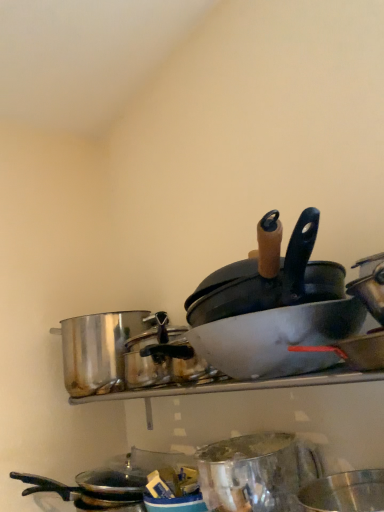
Question: Is metallic silver basin at center, arranged as the second basin when ordered from the bottom, taller than shiny metallic basin at lower right, which appears as the 1th basin when ordered from the bottom?

Choices:
 (A) yes
 (B) no

Answer: (B)

Question: Could you tell me if metallic silver basin at center, which ranks as the 1th basin in top-to-bottom order, is facing shiny metallic basin at lower right, the 2th basin when ordered from top to bottom?

Choices:
 (A) no
 (B) yes

Answer: (A)

Question: Is shiny metallic basin at lower right, which appears as the 1th basin when ordered from the bottom, located within metallic silver basin at center, arranged as the second basin when ordered from the bottom?

Choices:
 (A) yes
 (B) no

Answer: (B)

Question: Is metallic silver basin at center, which ranks as the 1th basin in top-to-bottom order, placed right next to shiny metallic basin at lower right, the 2th basin when ordered from top to bottom?

Choices:
 (A) yes
 (B) no

Answer: (B)

Question: Does metallic silver basin at center, which ranks as the 1th basin in top-to-bottom order, come behind shiny metallic basin at lower right, which appears as the 1th basin when ordered from the bottom?

Choices:
 (A) yes
 (B) no

Answer: (A)

Question: Is metallic silver basin at center, which ranks as the 1th basin in top-to-bottom order, facing away from shiny metallic basin at lower right, the 2th basin when ordered from top to bottom?

Choices:
 (A) yes
 (B) no

Answer: (B)

Question: Is shiny metallic pot at left behind matte white wok at center?

Choices:
 (A) yes
 (B) no

Answer: (A)

Question: From a real-world perspective, is shiny metallic pot at left physically below matte white wok at center?

Choices:
 (A) yes
 (B) no

Answer: (B)

Question: Does shiny metallic pot at left come in front of matte white wok at center?

Choices:
 (A) yes
 (B) no

Answer: (B)

Question: Is shiny metallic pot at left oriented towards matte white wok at center?

Choices:
 (A) no
 (B) yes

Answer: (A)

Question: From the image's perspective, is shiny metallic pot at left on matte white wok at center?

Choices:
 (A) yes
 (B) no

Answer: (B)

Question: Considering the relative sizes of shiny metallic pot at left and matte white wok at center in the image provided, is shiny metallic pot at left shorter than matte white wok at center?

Choices:
 (A) no
 (B) yes

Answer: (A)

Question: Does shiny metallic basin at lower right, the 2th basin when ordered from top to bottom, lie behind metallic silver basin at center, which ranks as the 1th basin in top-to-bottom order?

Choices:
 (A) yes
 (B) no

Answer: (B)